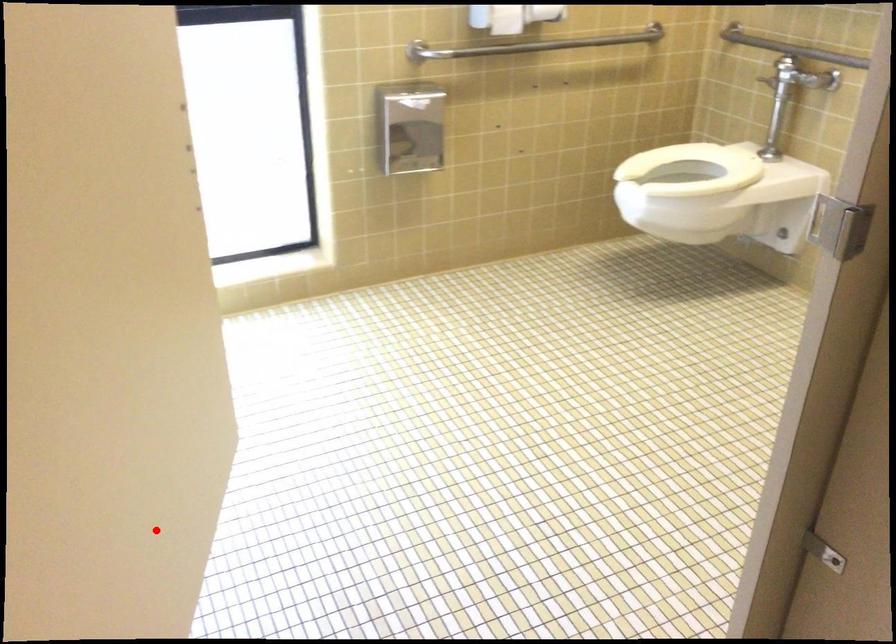
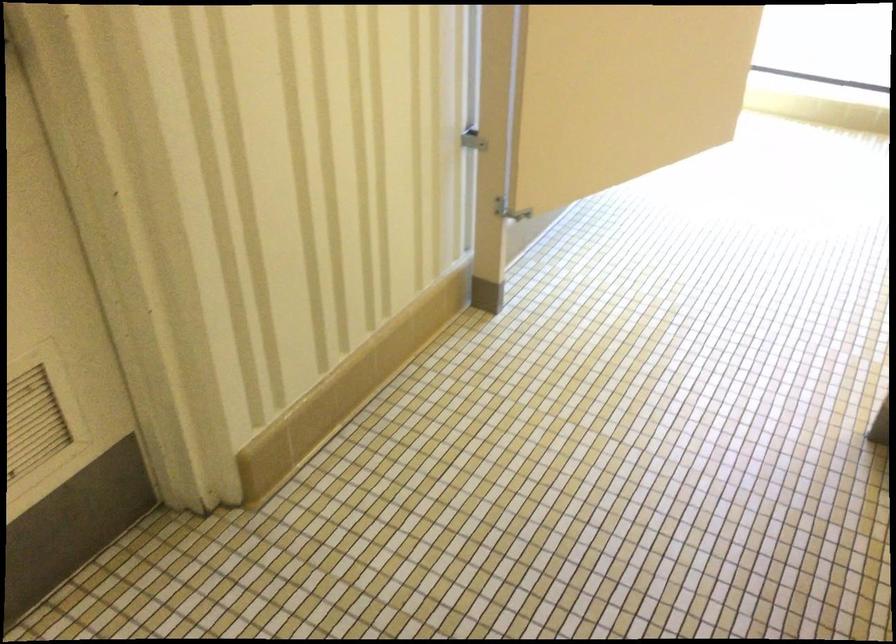
Where in the second image is the point corresponding to the highlighted location from the first image?

(623, 91)